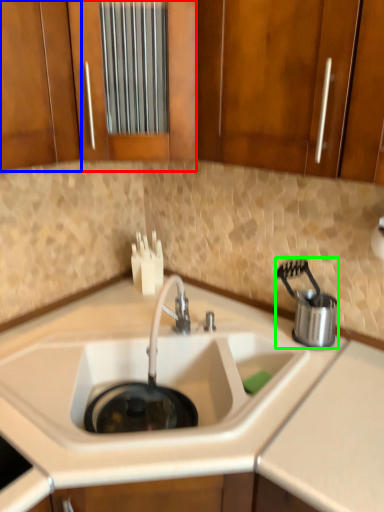
Question: Estimate the real-world distances between objects in this image. Which object is closer to cabinetry (highlighted by a red box), cabinetry (highlighted by a blue box) or appliance (highlighted by a green box)?

Choices:
 (A) cabinetry
 (B) appliance

Answer: (A)